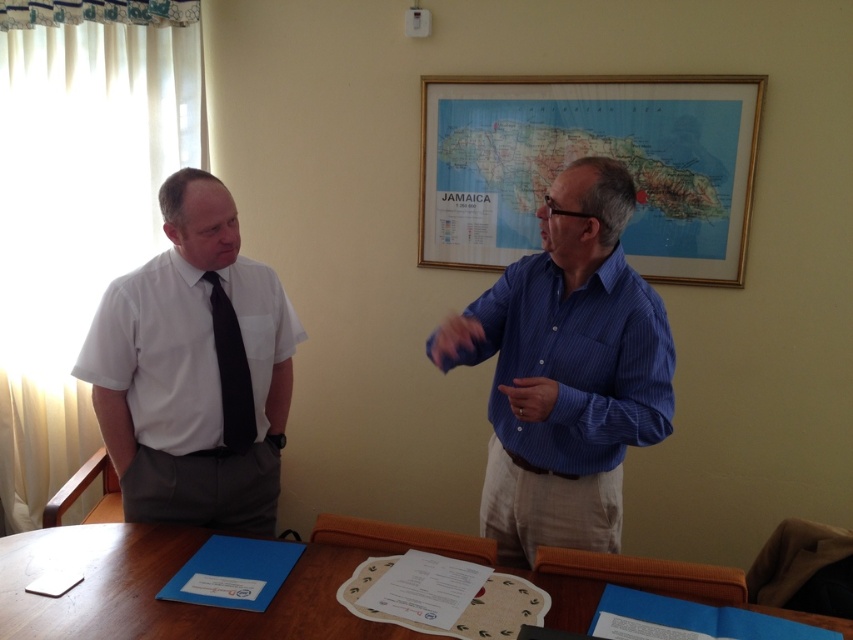
Does white shirt at left have a lesser width compared to black silk tie at left?

In fact, white shirt at left might be wider than black silk tie at left.

Who is more forward, (114, 324) or (244, 406)?

Positioned in front is point (114, 324).

At what (x,y) coordinates should I click in order to perform the action: click on white shirt at left. Please return your answer as a coordinate pair (x, y). The height and width of the screenshot is (640, 853). Looking at the image, I should click on (194, 371).

Is wooden table at lower center above black silk tie at left?

Incorrect, wooden table at lower center is not positioned above black silk tie at left.

What do you see at coordinates (160, 586) in the screenshot? The width and height of the screenshot is (853, 640). I see `wooden table at lower center` at bounding box center [160, 586].

At what (x,y) coordinates should I click in order to perform the action: click on wooden table at lower center. Please return your answer as a coordinate pair (x, y). Looking at the image, I should click on (160, 586).

Who is higher up, blue striped shirt at center or black silk tie at left?

black silk tie at left is higher up.

Can you confirm if blue striped shirt at center is thinner than black silk tie at left?

In fact, blue striped shirt at center might be wider than black silk tie at left.

The image size is (853, 640). In order to click on blue striped shirt at center in this screenshot , I will do `click(566, 371)`.

Find the location of a particular element. blue striped shirt at center is located at coordinates (566, 371).